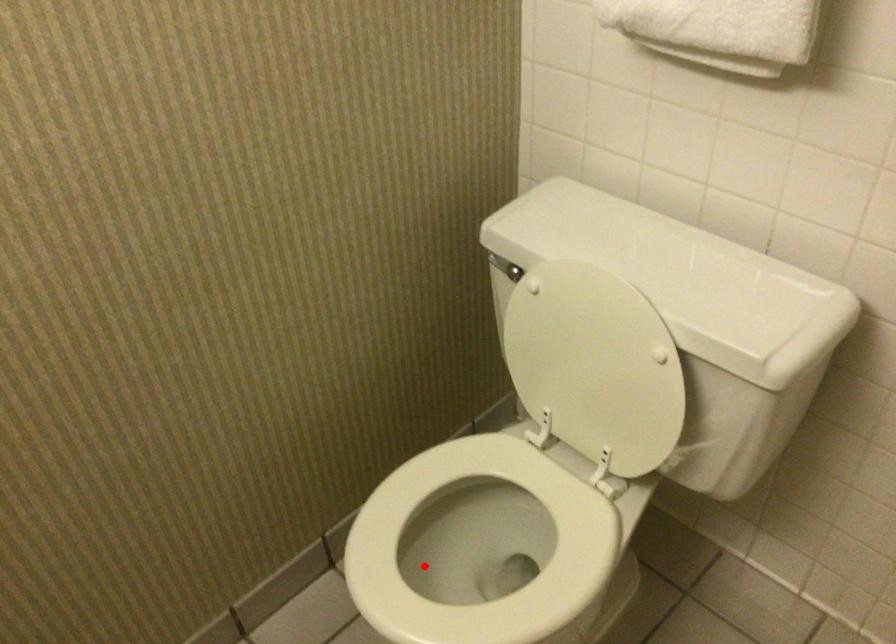
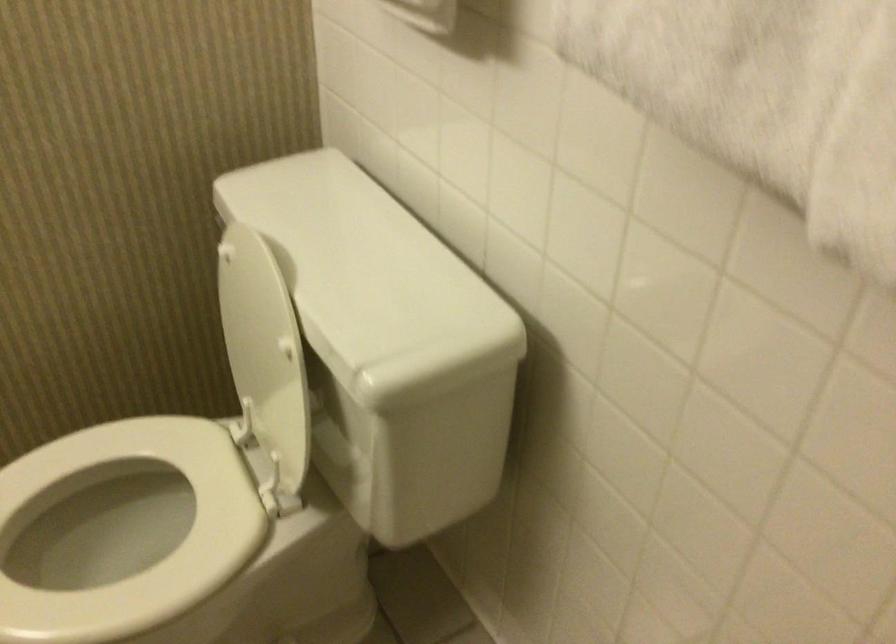
Question: I am providing you with two images of the same scene from different viewpoints. In image1, a red point is highlighted. Considering the same 3D point in image2, which of the following is correct?

Choices:
 (A) It is closer
 (B) It is farther

Answer: (A)